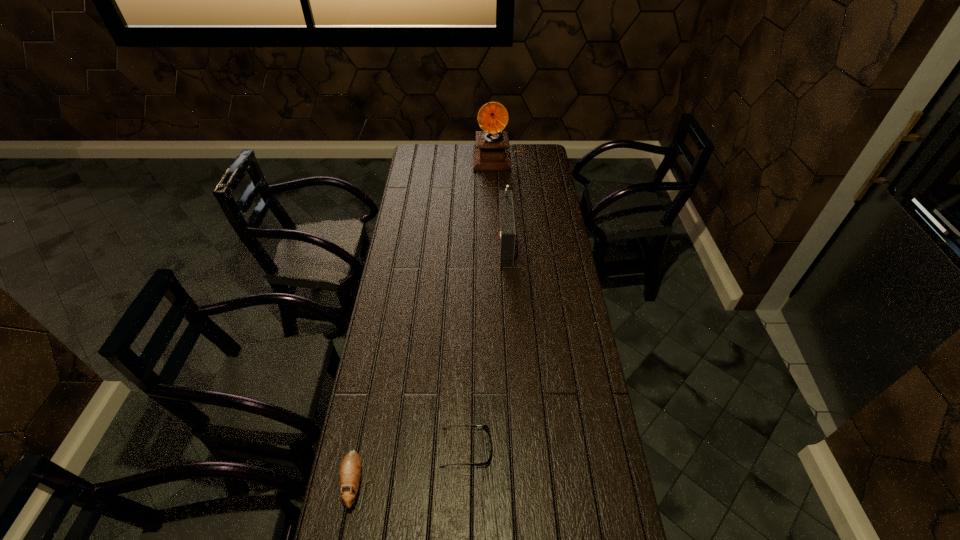
In the image, there is a desktop. Identify the location of vacant space at the far right corner. (542, 146).

This screenshot has height=540, width=960. Find the location of `unoccupied position between the third shortest object and the shortest object`. unoccupied position between the third shortest object and the shortest object is located at coordinates [x=485, y=345].

Find the location of a particular element. The width and height of the screenshot is (960, 540). vacant area between the sunglasses and the radio receiver is located at coordinates (485, 345).

At what (x,y) coordinates should I click in order to perform the action: click on empty location between the shortest object and the third nearest object. Please return your answer as a coordinate pair (x, y). Looking at the image, I should click on (485, 345).

The image size is (960, 540). Identify the location of free space between the third nearest object and the sunglasses. (485, 345).

Where is `vacant area between the shortest object and the phonograph record`? The image size is (960, 540). vacant area between the shortest object and the phonograph record is located at coordinates (482, 303).

I want to click on vacant area that lies between the tallest object and the leftmost object, so click(x=426, y=320).

You are a GUI agent. You are given a task and a screenshot of the screen. Output one action in this format:
    pyautogui.click(x=<x>, y=<y>)
    Task: Click on the free space between the hamster and the tallest object
    The height and width of the screenshot is (540, 960).
    Given the screenshot: What is the action you would take?
    pyautogui.click(x=426, y=320)

The height and width of the screenshot is (540, 960). I want to click on unoccupied area between the leftmost object and the sunglasses, so click(x=410, y=465).

You are a GUI agent. You are given a task and a screenshot of the screen. Output one action in this format:
    pyautogui.click(x=<x>, y=<y>)
    Task: Click on the free spot between the sunglasses and the third shortest object
    This screenshot has width=960, height=540.
    Given the screenshot: What is the action you would take?
    pyautogui.click(x=485, y=345)